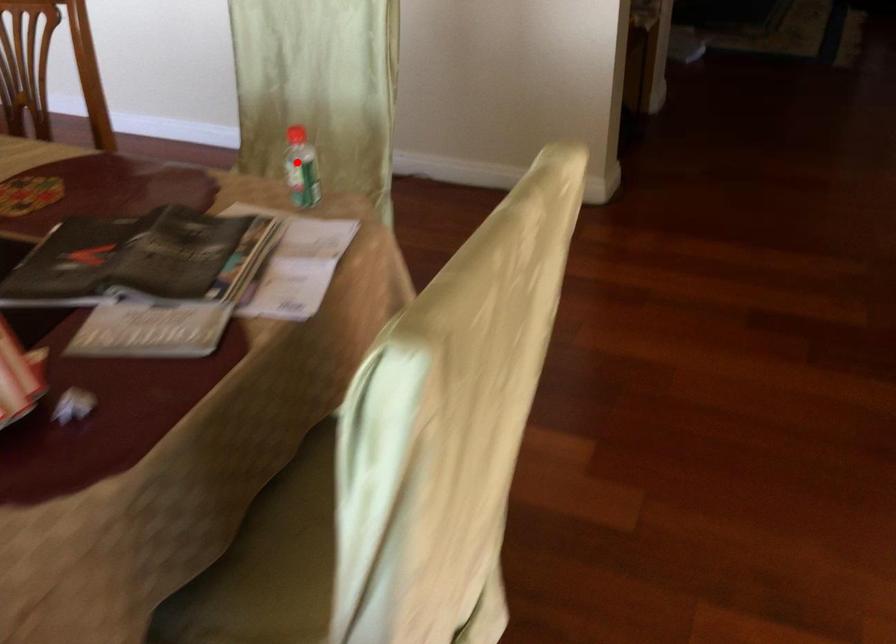
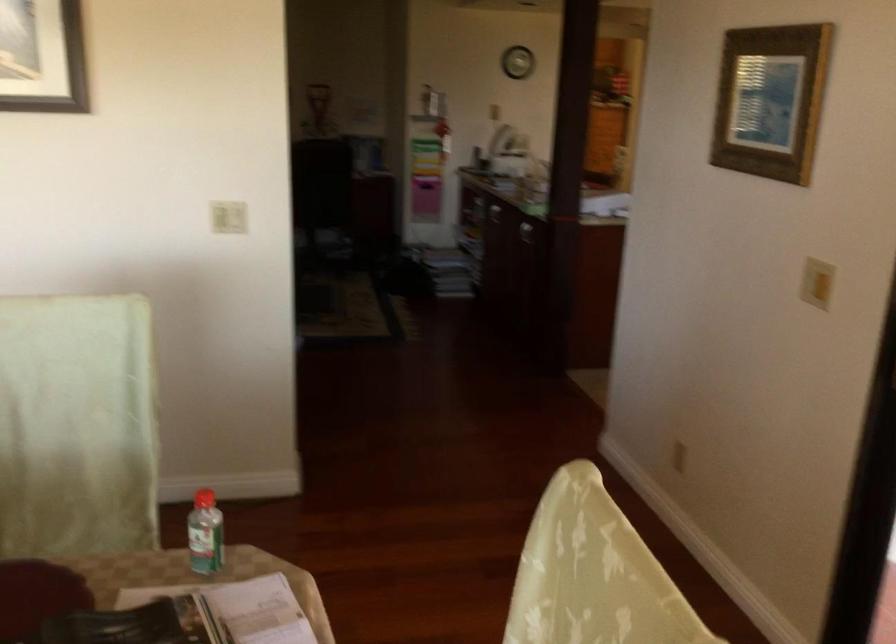
Find the pixel in the second image that matches the highlighted location in the first image.

(204, 534)